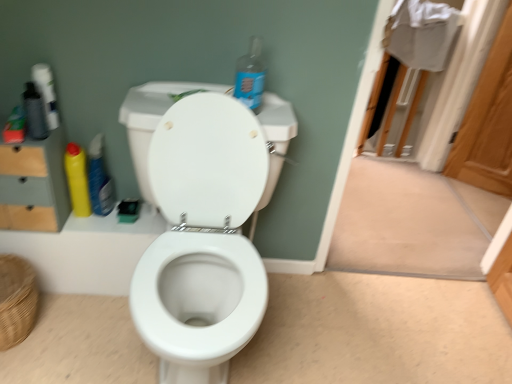
This screenshot has width=512, height=384. I want to click on free point to the right of yellow matte bottle at left, which ranks as the 1th cleaning product in left-to-right order, so click(x=126, y=221).